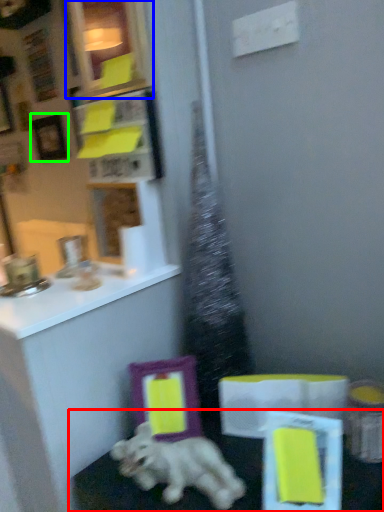
Question: Which is farther away from table (highlighted by a red box)? picture frame (highlighted by a blue box) or picture frame (highlighted by a green box)?

Choices:
 (A) picture frame
 (B) picture frame

Answer: (B)